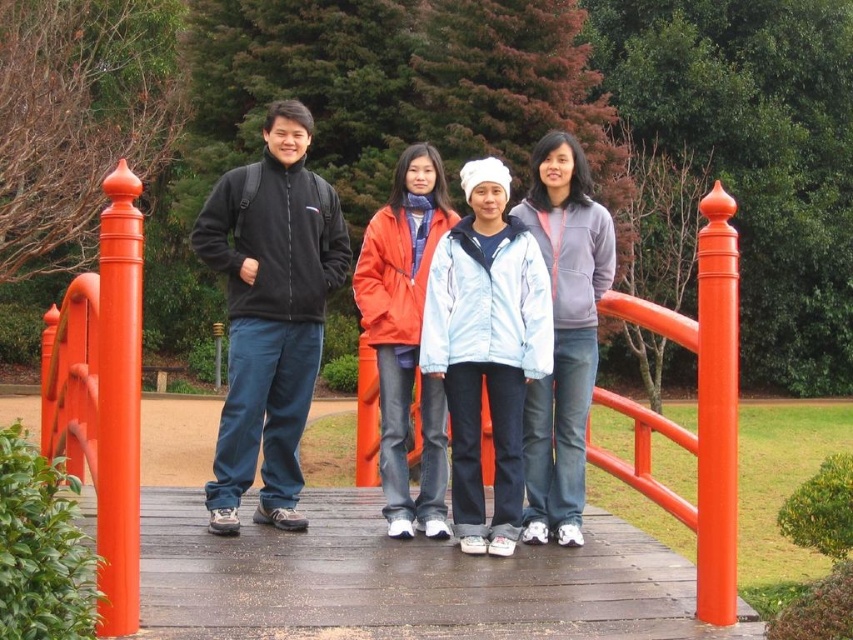
Question: Considering the relative positions of light blue fleece jacket at center and orange matte jacket at center in the image provided, where is light blue fleece jacket at center located with respect to orange matte jacket at center?

Choices:
 (A) left
 (B) right

Answer: (B)

Question: Which of the following is the closest to the observer?

Choices:
 (A) (508, 316)
 (B) (288, 419)

Answer: (A)

Question: In this image, where is matte black jacket at center located relative to black fleece jacket at left?

Choices:
 (A) above
 (B) below

Answer: (B)

Question: Which point appears farthest from the camera in this image?

Choices:
 (A) (532, 212)
 (B) (502, 225)
 (C) (425, 460)
 (D) (270, 480)

Answer: (D)

Question: Based on their relative distances, which object is farther from the matte black jacket at center?

Choices:
 (A) gray fleece jacket at center
 (B) orange matte jacket at center
 (C) light blue fleece jacket at center
 (D) black fleece jacket at left

Answer: (A)

Question: Can you confirm if matte black jacket at center is positioned above gray fleece jacket at center?

Choices:
 (A) no
 (B) yes

Answer: (B)